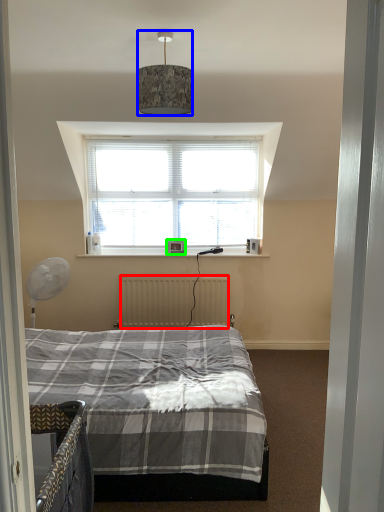
Question: Estimate the real-world distances between objects in this image. Which object is farther from radiator (highlighted by a red box), lamp (highlighted by a blue box) or picture frame (highlighted by a green box)?

Choices:
 (A) lamp
 (B) picture frame

Answer: (A)